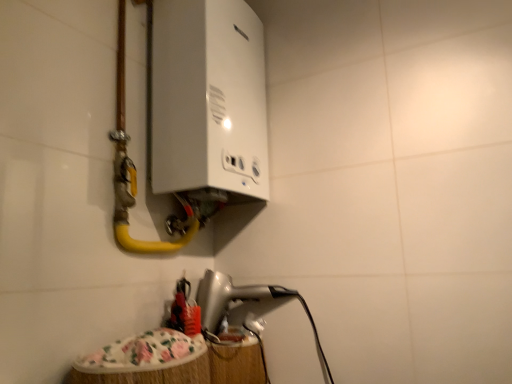
Question: Is yellow rubber hose at upper left taller than white glossy boiler at upper center, marked as the 1th appliance in a top-to-bottom arrangement?

Choices:
 (A) no
 (B) yes

Answer: (B)

Question: Can you confirm if yellow rubber hose at upper left is bigger than white glossy boiler at upper center, the 2th appliance in the bottom-to-top sequence?

Choices:
 (A) no
 (B) yes

Answer: (B)

Question: Is white glossy boiler at upper center, the 2th appliance in the bottom-to-top sequence, inside yellow rubber hose at upper left?

Choices:
 (A) yes
 (B) no

Answer: (A)

Question: Is yellow rubber hose at upper left at the right side of white glossy boiler at upper center, the 2th appliance in the bottom-to-top sequence?

Choices:
 (A) yes
 (B) no

Answer: (B)

Question: From the image's perspective, is yellow rubber hose at upper left on top of white glossy boiler at upper center, the 2th appliance in the bottom-to-top sequence?

Choices:
 (A) yes
 (B) no

Answer: (B)

Question: From a real-world perspective, is silver metallic hairdryer at lower center, which is the first appliance in bottom-to-top order, positioned above or below yellow rubber hose at upper left?

Choices:
 (A) above
 (B) below

Answer: (B)

Question: Considering the relative positions of silver metallic hairdryer at lower center, which appears as the second appliance when viewed from the top, and yellow rubber hose at upper left in the image provided, is silver metallic hairdryer at lower center, which appears as the second appliance when viewed from the top, to the left or to the right of yellow rubber hose at upper left?

Choices:
 (A) right
 (B) left

Answer: (A)

Question: Is silver metallic hairdryer at lower center, which is the first appliance in bottom-to-top order, inside the boundaries of yellow rubber hose at upper left, or outside?

Choices:
 (A) outside
 (B) inside

Answer: (A)

Question: In terms of size, does silver metallic hairdryer at lower center, which appears as the second appliance when viewed from the top, appear bigger or smaller than yellow rubber hose at upper left?

Choices:
 (A) small
 (B) big

Answer: (A)

Question: Is white glossy boiler at upper center, marked as the 1th appliance in a top-to-bottom arrangement, spatially inside yellow rubber hose at upper left, or outside of it?

Choices:
 (A) inside
 (B) outside

Answer: (A)

Question: Considering their positions, is white glossy boiler at upper center, the 2th appliance in the bottom-to-top sequence, located in front of or behind yellow rubber hose at upper left?

Choices:
 (A) front
 (B) behind

Answer: (B)

Question: From the image's perspective, is white glossy boiler at upper center, marked as the 1th appliance in a top-to-bottom arrangement, above or below yellow rubber hose at upper left?

Choices:
 (A) below
 (B) above

Answer: (B)

Question: From a real-world perspective, is white glossy boiler at upper center, the 2th appliance in the bottom-to-top sequence, above or below yellow rubber hose at upper left?

Choices:
 (A) below
 (B) above

Answer: (B)

Question: Looking at their shapes, would you say yellow rubber hose at upper left is wider or thinner than silver metallic hairdryer at lower center, which is the first appliance in bottom-to-top order?

Choices:
 (A) thin
 (B) wide

Answer: (A)

Question: Which is correct: yellow rubber hose at upper left is inside silver metallic hairdryer at lower center, which is the first appliance in bottom-to-top order, or outside of it?

Choices:
 (A) inside
 (B) outside

Answer: (B)